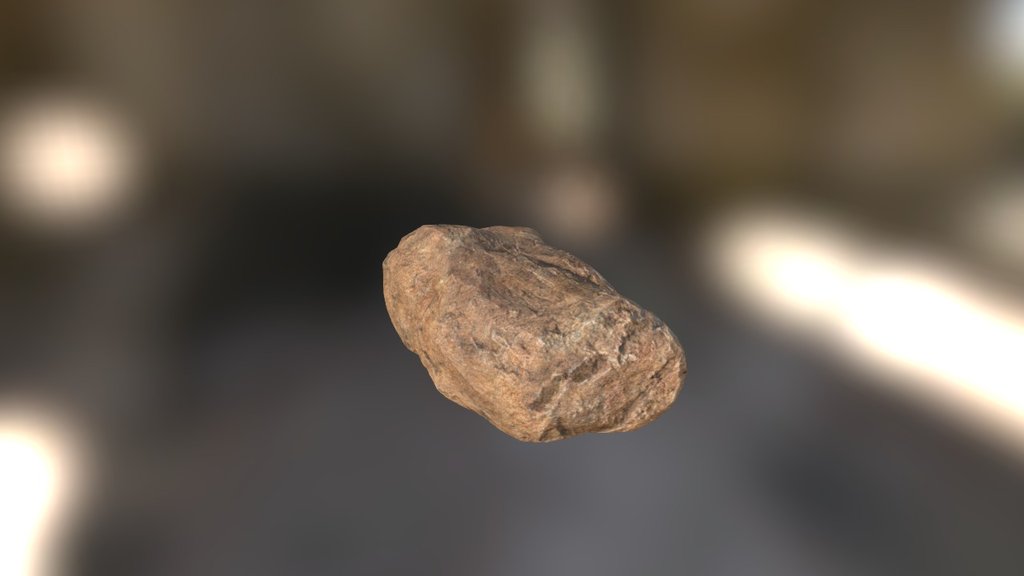
What are the coordinates of `light in the background` in the screenshot? It's located at (800, 271), (929, 328), (56, 149), (32, 472).